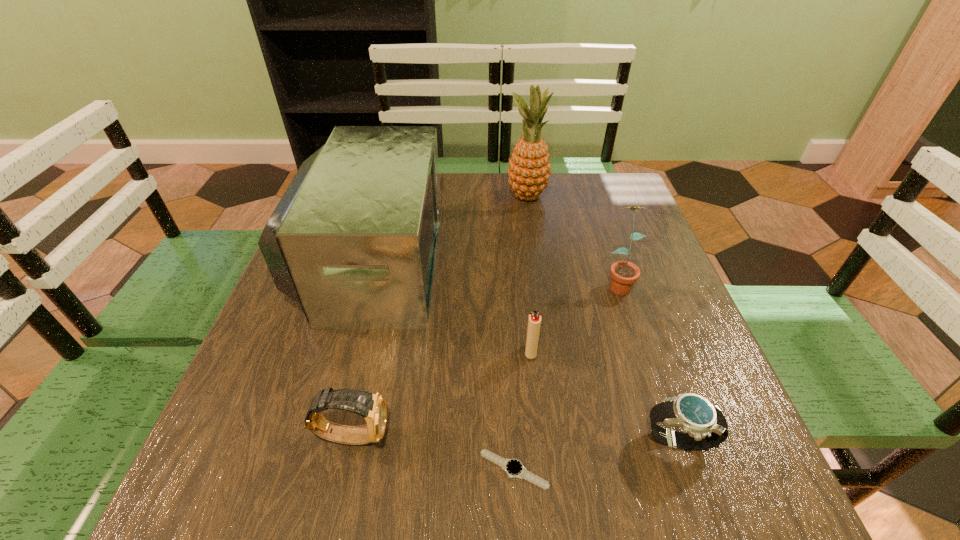
You are a GUI agent. You are given a task and a screenshot of the screen. Output one action in this format:
    pyautogui.click(x=<x>, y=<y>)
    Task: Click on the pineapple
    The image size is (960, 540).
    Given the screenshot: What is the action you would take?
    [x=529, y=169]

Identify the location of the tallest object. Image resolution: width=960 pixels, height=540 pixels. (529, 169).

Find the location of a particular element. The width and height of the screenshot is (960, 540). the sixth shortest object is located at coordinates (353, 240).

You are a GUI agent. You are given a task and a screenshot of the screen. Output one action in this format:
    pyautogui.click(x=<x>, y=<y>)
    Task: Click on the sunflower
    The width and height of the screenshot is (960, 540).
    Given the screenshot: What is the action you would take?
    pyautogui.click(x=624, y=274)

This screenshot has width=960, height=540. I want to click on the leftmost watch, so click(372, 407).

Identify the location of igniter. (534, 321).

Identify the location of the rightmost watch. (704, 426).

Identify the location of the sixth tallest object. (704, 426).

This screenshot has height=540, width=960. What are the coordinates of `the shortest object` in the screenshot? It's located at (514, 468).

Identify the location of the shortest watch. The height and width of the screenshot is (540, 960). (514, 468).